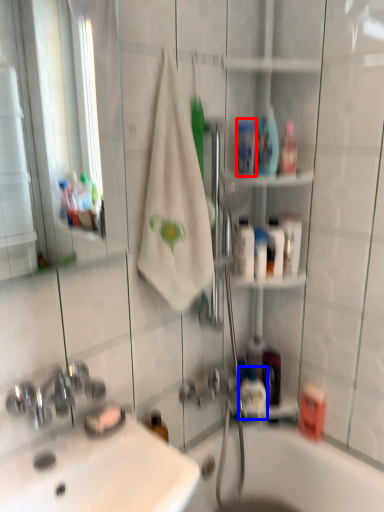
Question: Which object appears closest to the camera in this image, mouthwash (highlighted by a red box) or mouthwash (highlighted by a blue box)?

Choices:
 (A) mouthwash
 (B) mouthwash

Answer: (A)